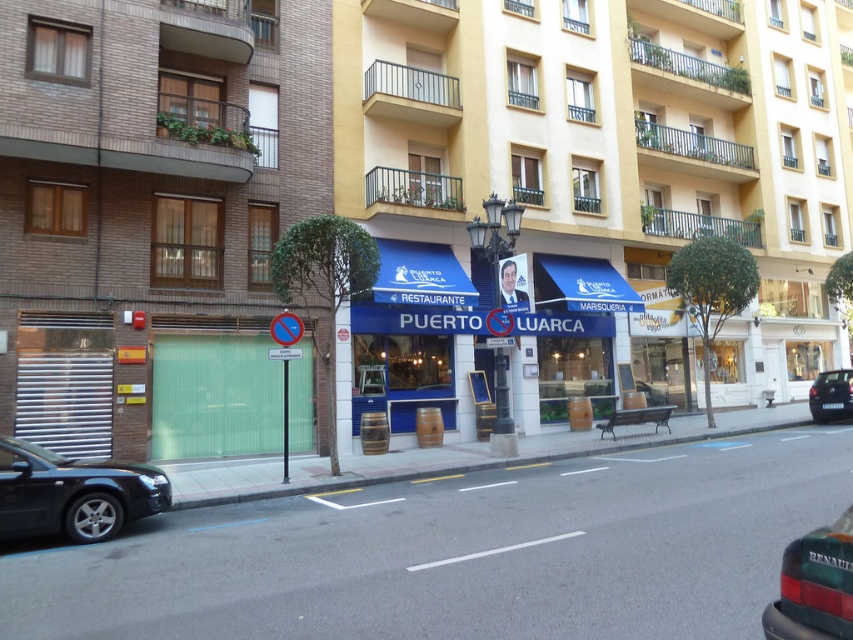
Can you confirm if blue painted wooden awning at center is positioned above black metallic car at lower right?

Correct, blue painted wooden awning at center is located above black metallic car at lower right.

Which is behind, point (595, 388) or point (815, 406)?

Point (595, 388)

I want to click on blue painted wooden awning at center, so click(419, 336).

Is blue awning restaurant at center below black metallic car at lower right?

No.

Which is above, blue awning restaurant at center or black metallic car at lower right?

Positioned higher is blue awning restaurant at center.

Measure the distance between point (546,99) and camera.

They are 67.08 feet apart.

Where is `blue awning restaurant at center`? The image size is (853, 640). blue awning restaurant at center is located at coordinates (614, 170).

Does blue awning restaurant at center appear over blue painted wooden awning at center?

Indeed, blue awning restaurant at center is positioned over blue painted wooden awning at center.

Is blue awning restaurant at center shorter than blue painted wooden awning at center?

Incorrect, blue awning restaurant at center's height does not fall short of blue painted wooden awning at center's.

Between point (747, 179) and point (384, 376), which one is positioned behind?

Positioned behind is point (747, 179).

Locate an element on the screen. The width and height of the screenshot is (853, 640). blue awning restaurant at center is located at coordinates (614, 170).